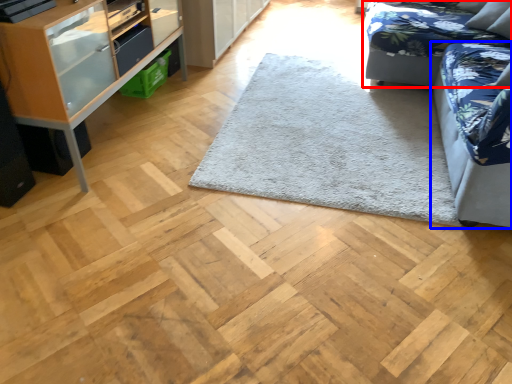
Question: Which object appears closest to the camera in this image, studio couch (highlighted by a red box) or studio couch (highlighted by a blue box)?

Choices:
 (A) studio couch
 (B) studio couch

Answer: (B)